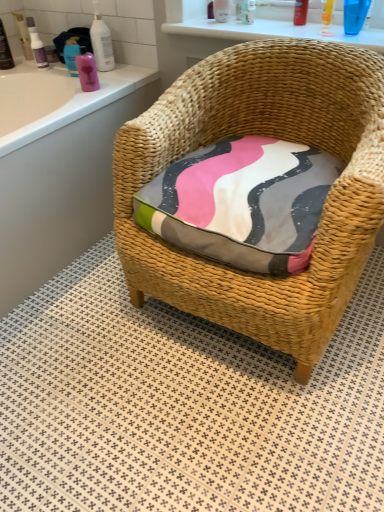
Image resolution: width=384 pixels, height=512 pixels. What do you see at coordinates (101, 42) in the screenshot? I see `white glossy bottle at upper left, the sixth toiletry viewed from the left` at bounding box center [101, 42].

What do you see at coordinates (270, 136) in the screenshot?
I see `woven wicker chair at center` at bounding box center [270, 136].

Locate an element on the screen. The width and height of the screenshot is (384, 512). translucent plastic bottle at upper center, placed as the fourth toiletry when sorted from right to left is located at coordinates (221, 10).

Locate an element on the screen. The width and height of the screenshot is (384, 512). translucent plastic bottle at upper left, which is the eighth toiletry from right to left is located at coordinates (38, 50).

Image resolution: width=384 pixels, height=512 pixels. In order to click on matte plastic bottle at upper left, acting as the 9th toiletry starting from the right in this screenshot , I will do `click(23, 35)`.

Locate an element on the screen. transparent plastic cup at upper right, placed as the tenth toiletry when sorted from left to right is located at coordinates (355, 15).

Are textured fabric pillow at center and white textured tile at center far apart?

No.

Which object is more forward, textured fabric pillow at center or white textured tile at center?

Positioned in front is white textured tile at center.

Between point (195, 243) and point (160, 309), which one is positioned in front?

Point (195, 243)

Is pink glossy bottle at upper left, the fifth toiletry viewed from the left, beside transparent plastic cup at upper right, the 1th toiletry from the right?

No, pink glossy bottle at upper left, the fifth toiletry viewed from the left, is not making contact with transparent plastic cup at upper right, the 1th toiletry from the right.

Which of these two, pink glossy bottle at upper left, which is counted as the 6th toiletry, starting from the right, or transparent plastic cup at upper right, the 1th toiletry from the right, stands taller?

transparent plastic cup at upper right, the 1th toiletry from the right.

Is transparent plastic cup at upper right, placed as the tenth toiletry when sorted from left to right, a part of pink glossy bottle at upper left, the fifth toiletry viewed from the left?

No, transparent plastic cup at upper right, placed as the tenth toiletry when sorted from left to right, is not inside pink glossy bottle at upper left, the fifth toiletry viewed from the left.

From the image's perspective, does pink glossy bottle at upper left, which is counted as the 6th toiletry, starting from the right, appear lower than transparent plastic cup at upper right, the 1th toiletry from the right?

Yes.

Can you confirm if white glossy bottle at upper left, the fifth toiletry in the right-to-left sequence, is thinner than white glossy bathtub at upper left?

Correct, the width of white glossy bottle at upper left, the fifth toiletry in the right-to-left sequence, is less than that of white glossy bathtub at upper left.

Visually, is white glossy bottle at upper left, the sixth toiletry viewed from the left, positioned to the left or to the right of white glossy bathtub at upper left?

Clearly, white glossy bottle at upper left, the sixth toiletry viewed from the left, is on the right of white glossy bathtub at upper left in the image.

Considering the positions of objects white glossy bottle at upper left, the fifth toiletry in the right-to-left sequence, and white glossy bathtub at upper left in the image provided, who is in front, white glossy bottle at upper left, the fifth toiletry in the right-to-left sequence, or white glossy bathtub at upper left?

Positioned in front is white glossy bathtub at upper left.

Consider the image. Is transparent plastic cup at upper right, placed as the tenth toiletry when sorted from left to right, outside of translucent plastic bottle at upper center, the ninth toiletry from the left?

transparent plastic cup at upper right, placed as the tenth toiletry when sorted from left to right, lies outside translucent plastic bottle at upper center, the ninth toiletry from the left,'s area.

Looking at their sizes, would you say transparent plastic cup at upper right, placed as the tenth toiletry when sorted from left to right, is wider or thinner than translucent plastic bottle at upper center, acting as the second toiletry starting from the right?

transparent plastic cup at upper right, placed as the tenth toiletry when sorted from left to right, is thinner than translucent plastic bottle at upper center, acting as the second toiletry starting from the right.

From their relative heights in the image, would you say transparent plastic cup at upper right, the 1th toiletry from the right, is taller or shorter than translucent plastic bottle at upper center, acting as the second toiletry starting from the right?

Clearly, transparent plastic cup at upper right, the 1th toiletry from the right, is shorter compared to translucent plastic bottle at upper center, acting as the second toiletry starting from the right.

Is transparent plastic cup at upper right, placed as the tenth toiletry when sorted from left to right, to the left of translucent plastic bottle at upper center, the ninth toiletry from the left, from the viewer's perspective?

No, transparent plastic cup at upper right, placed as the tenth toiletry when sorted from left to right, is not to the left of translucent plastic bottle at upper center, the ninth toiletry from the left.

Measure the distance between translucent plastic bottle at upper left, which is the eighth toiletry from right to left, and matte plastic bottle at upper left, the 2th toiletry in the left-to-right sequence.

2.04 inches.

Locate an element on the screen. Image resolution: width=384 pixels, height=512 pixels. the 6th toiletry below the matte plastic bottle at upper left, acting as the 9th toiletry starting from the right (from the image's perspective) is located at coordinates (38, 50).

Which of these two, translucent plastic bottle at upper left, the 3th toiletry positioned from the left, or matte plastic bottle at upper left, the 2th toiletry in the left-to-right sequence, is thinner?

translucent plastic bottle at upper left, the 3th toiletry positioned from the left.

From a real-world perspective, is translucent plastic bottle at upper left, the 3th toiletry positioned from the left, physically above matte plastic bottle at upper left, acting as the 9th toiletry starting from the right?

Incorrect, from a real-world perspective, translucent plastic bottle at upper left, the 3th toiletry positioned from the left, is lower than matte plastic bottle at upper left, acting as the 9th toiletry starting from the right.

Would you say pink glossy bottle at upper left, the fifth toiletry viewed from the left, is part of translucent plastic bottle at upper center, placed as the fourth toiletry when sorted from right to left,'s contents?

Actually, pink glossy bottle at upper left, the fifth toiletry viewed from the left, is outside translucent plastic bottle at upper center, placed as the fourth toiletry when sorted from right to left.

Is translucent plastic bottle at upper center, placed as the fourth toiletry when sorted from right to left, at the right side of pink glossy bottle at upper left, the fifth toiletry viewed from the left?

Indeed, translucent plastic bottle at upper center, placed as the fourth toiletry when sorted from right to left, is positioned on the right side of pink glossy bottle at upper left, the fifth toiletry viewed from the left.

Locate an element on the screen. The height and width of the screenshot is (512, 384). the 2nd toiletry counting from the right side of the pink glossy bottle at upper left, the fifth toiletry viewed from the left is located at coordinates coord(221,10).

How different are the orientations of translucent plastic bottle at upper center, acting as the 7th toiletry starting from the left, and pink glossy bottle at upper left, the fifth toiletry viewed from the left, in degrees?

There is a 0.579-degree angle between the facing directions of translucent plastic bottle at upper center, acting as the 7th toiletry starting from the left, and pink glossy bottle at upper left, the fifth toiletry viewed from the left.

Is matte plastic bottle at upper left, acting as the 9th toiletry starting from the right, not inside white glossy bottle at upper left, the sixth toiletry viewed from the left?

Yes, matte plastic bottle at upper left, acting as the 9th toiletry starting from the right, is not within white glossy bottle at upper left, the sixth toiletry viewed from the left.

Which is more distant, (26,37) or (100,60)?

The point (26,37) is farther from the camera.

Looking at this image, is there a large distance between matte plastic bottle at upper left, the 2th toiletry in the left-to-right sequence, and white glossy bottle at upper left, the sixth toiletry viewed from the left?

No.

Considering the sizes of objects matte plastic bottle at upper left, acting as the 9th toiletry starting from the right, and white glossy bottle at upper left, the sixth toiletry viewed from the left, in the image provided, who is wider, matte plastic bottle at upper left, acting as the 9th toiletry starting from the right, or white glossy bottle at upper left, the sixth toiletry viewed from the left,?

With larger width is white glossy bottle at upper left, the sixth toiletry viewed from the left.

This screenshot has height=512, width=384. What are the coordinates of `tile located underneath the textured fabric pillow at center (from a real-world perspective)` in the screenshot? It's located at (183, 405).

Which toiletry is the 5th one when counting from the left side of the transparent plastic cup at upper right, the 1th toiletry from the right? Please provide its 2D coordinates.

[(87, 70)]

Which object lies further to the anchor point transparent plastic cup at upper right, the 1th toiletry from the right, translucent plastic bottle at upper center, acting as the second toiletry starting from the right, or pink glossy bottle at upper left, which is counted as the 6th toiletry, starting from the right?

pink glossy bottle at upper left, which is counted as the 6th toiletry, starting from the right, is further to transparent plastic cup at upper right, the 1th toiletry from the right.

Considering their positions, is pink glossy bottle at upper left, the fourth toiletry viewed from the left, positioned further to matte plastic bottle at upper left, the 2th toiletry in the left-to-right sequence, than white glossy bottle at upper left, the sixth toiletry viewed from the left?

white glossy bottle at upper left, the sixth toiletry viewed from the left, lies further to matte plastic bottle at upper left, the 2th toiletry in the left-to-right sequence, than the other object.

Estimate the real-world distances between objects in this image. Which object is further from white glossy bottle at upper left, the sixth toiletry viewed from the left, matte plastic bottle at upper left, acting as the 9th toiletry starting from the right, or woven wicker chair at center?

Among the two, woven wicker chair at center is located further to white glossy bottle at upper left, the sixth toiletry viewed from the left.

Estimate the real-world distances between objects in this image. Which object is further from pink glossy bottle at upper left, acting as the seventh toiletry starting from the right, woven wicker chair at center or transparent plastic cup at upper right, the 1th toiletry from the right?

transparent plastic cup at upper right, the 1th toiletry from the right, is positioned further to the anchor pink glossy bottle at upper left, acting as the seventh toiletry starting from the right.

Looking at this image, when comparing their distances from pink glossy bottle at upper left, the fifth toiletry viewed from the left, does matte black bottle at upper left, which is the tenth toiletry from right to left, or woven wicker chair at center seem closer?

Among the two, matte black bottle at upper left, which is the tenth toiletry from right to left, is located nearer to pink glossy bottle at upper left, the fifth toiletry viewed from the left.

Which object lies further to the anchor point pink glossy bottle at upper left, the fifth toiletry viewed from the left, translucent plastic bottle at upper center, placed as the fourth toiletry when sorted from right to left, or translucent plastic bottle at upper center, the 3th toiletry viewed from the right?

translucent plastic bottle at upper center, the 3th toiletry viewed from the right, lies further to pink glossy bottle at upper left, the fifth toiletry viewed from the left, than the other object.

Looking at the image, which one is located closer to matte black bottle at upper left, the 1th toiletry when ordered from left to right, translucent plastic bottle at upper left, which is the eighth toiletry from right to left, or woven wicker chair at center?

Among the two, translucent plastic bottle at upper left, which is the eighth toiletry from right to left, is located nearer to matte black bottle at upper left, the 1th toiletry when ordered from left to right.

When comparing their distances from translucent plastic bottle at upper center, the ninth toiletry from the left, does translucent plastic bottle at upper center, acting as the 7th toiletry starting from the left, or pink glossy bottle at upper left, which is counted as the 6th toiletry, starting from the right, seem further?

Based on the image, pink glossy bottle at upper left, which is counted as the 6th toiletry, starting from the right, appears to be further to translucent plastic bottle at upper center, the ninth toiletry from the left.

At what (x,y) coordinates should I click in order to perform the action: click on chair located between translucent plastic bottle at upper left, the 3th toiletry positioned from the left, and translucent plastic bottle at upper center, acting as the second toiletry starting from the right, in the left-right direction. Please return your answer as a coordinate pair (x, y). Looking at the image, I should click on (270, 136).

Where is `tile between woven wicker chair at center and translucent plastic bottle at upper left, the 3th toiletry positioned from the left, along the z-axis`? tile between woven wicker chair at center and translucent plastic bottle at upper left, the 3th toiletry positioned from the left, along the z-axis is located at coordinates (183, 405).

Find the location of `bathtub positioned between woven wicker chair at center and translucent plastic bottle at upper left, which is the eighth toiletry from right to left, from near to far`. bathtub positioned between woven wicker chair at center and translucent plastic bottle at upper left, which is the eighth toiletry from right to left, from near to far is located at coordinates (62, 176).

Where is `throw pillow between white glossy bathtub at upper left and transparent plastic cup at upper right, the 1th toiletry from the right, from left to right`? The height and width of the screenshot is (512, 384). throw pillow between white glossy bathtub at upper left and transparent plastic cup at upper right, the 1th toiletry from the right, from left to right is located at coordinates (242, 203).